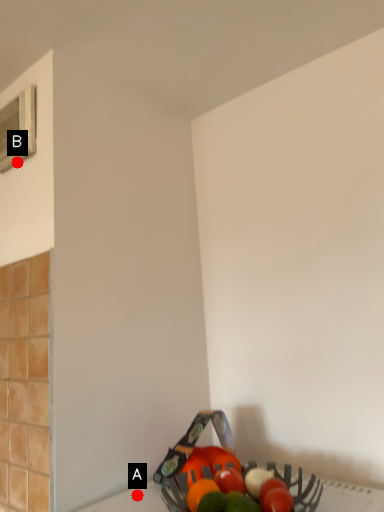
Question: Two points are circled on the image, labeled by A and B beside each circle. Which point is farther to the camera?

Choices:
 (A) A is further
 (B) B is further

Answer: (B)